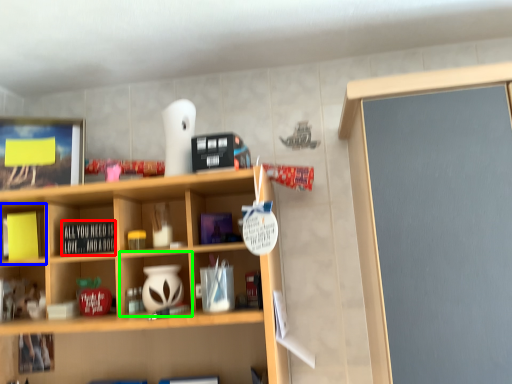
Question: Which object is positioned farthest from book (highlighted by a red box)? Select from cabinet (highlighted by a blue box) and cabinet (highlighted by a green box).

Choices:
 (A) cabinet
 (B) cabinet

Answer: (A)